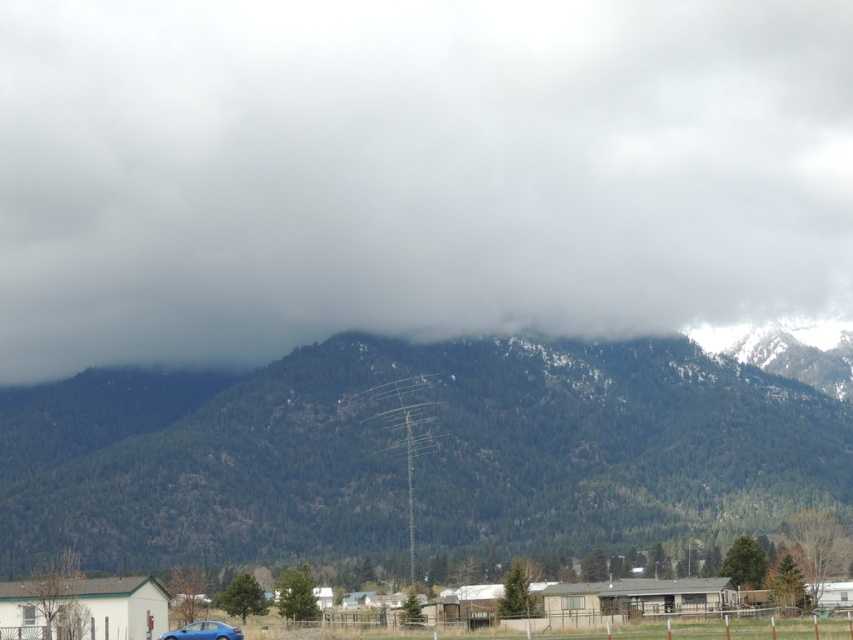
You are an airplane pilot flying over the mountain range. You notice a point at coordinates [415,173]. What would you see there?

At point [415,173] lies a white fluffy cloud at upper center.

You are an airplane passenger looking out the window. You see the white fluffy cloud at upper center and the green forested mountain at center. Which object appears larger from your perspective?

The white fluffy cloud at upper center appears larger than the green forested mountain at center because it is bigger in size.